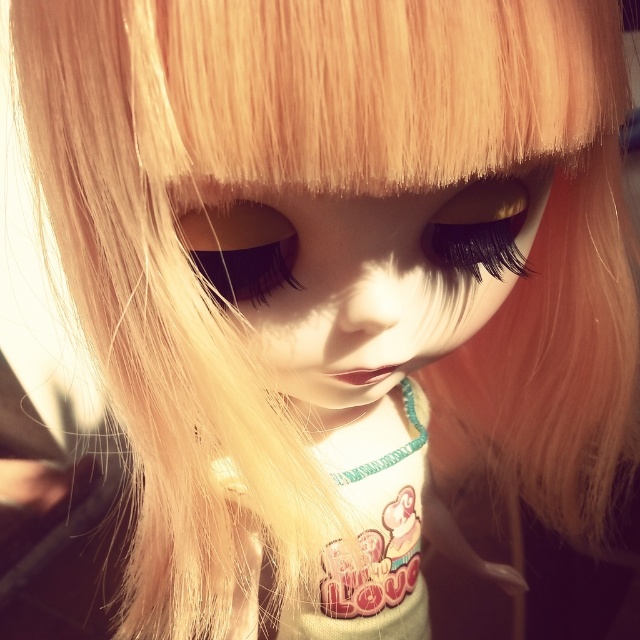
You are an artist creating a portrait of the doll and need to ensure proportions are accurate. Which object has a greater width between the satin blonde hair at center and the satin black eye at center?

The satin blonde hair at center has a greater width than the satin black eye at center, as stated in the description.

In the scene shown: You are a photographer adjusting your camera focus. You notice two points in the image labeled as point (256, 227) and point (500, 260). Which point should you focus on first if you want to ensure the closest object is in focus?

Point (256, 227) is closer to the camera than point (500, 260), so you should focus on point (256, 227) first to ensure the closest object is in focus.